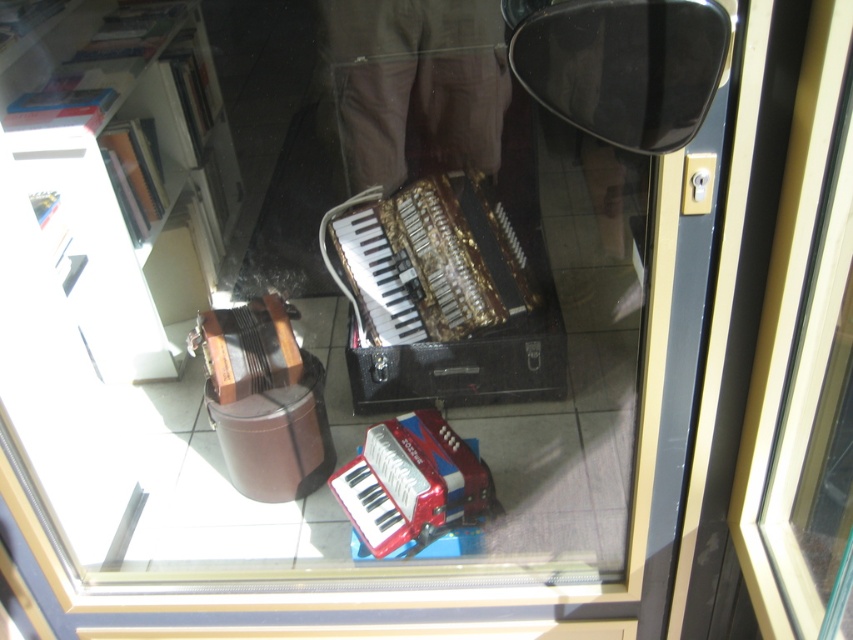
You are a visitor looking at the display case and want to know if the white glossy bookshelf at upper left can be seen through the glass case along with the gold metallic accordion at center. Can you see both objects clearly?

The white glossy bookshelf at upper left is larger in size than the gold metallic accordion at center, so yes, both objects can be seen clearly through the glass case.

You are a visitor looking at the display case. You see the gold metallic accordion at center and the metallic red accordion at center. Which one is closer to you?

The gold metallic accordion at center is closer to you because the metallic red accordion at center is behind it.

You are standing in front of a display case with three accordions. You want to touch the point at coordinates point (506, 253) inside the case. If your arm can reach 2 meters, can you reach that point?

The distance of point (506, 253) from viewer is 1.99 meters, so yes, your arm can reach it since it is within the 2 meters limit.